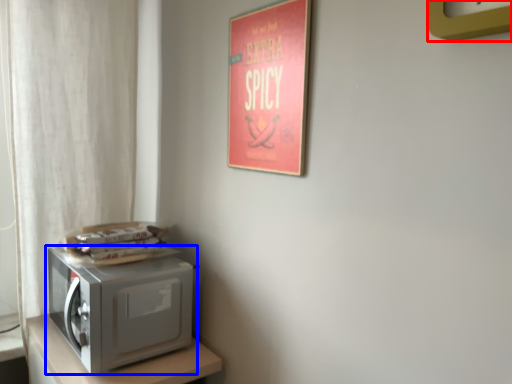
Question: Among these objects, which one is nearest to the camera, clock (highlighted by a red box) or home appliance (highlighted by a blue box)?

Choices:
 (A) clock
 (B) home appliance

Answer: (A)